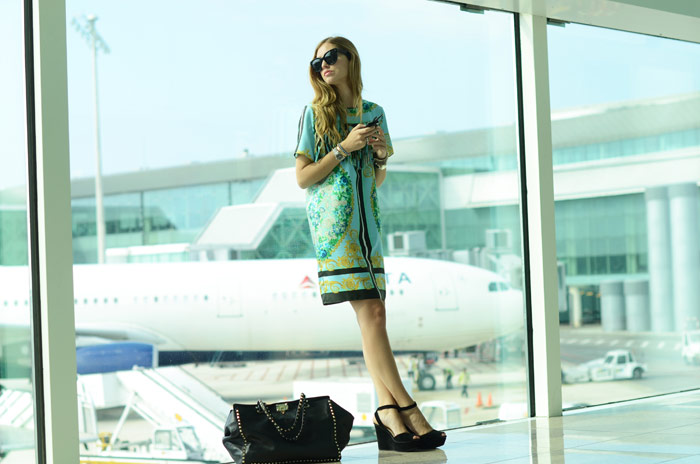
Identify the location of phone. Image resolution: width=700 pixels, height=464 pixels. (370, 123).